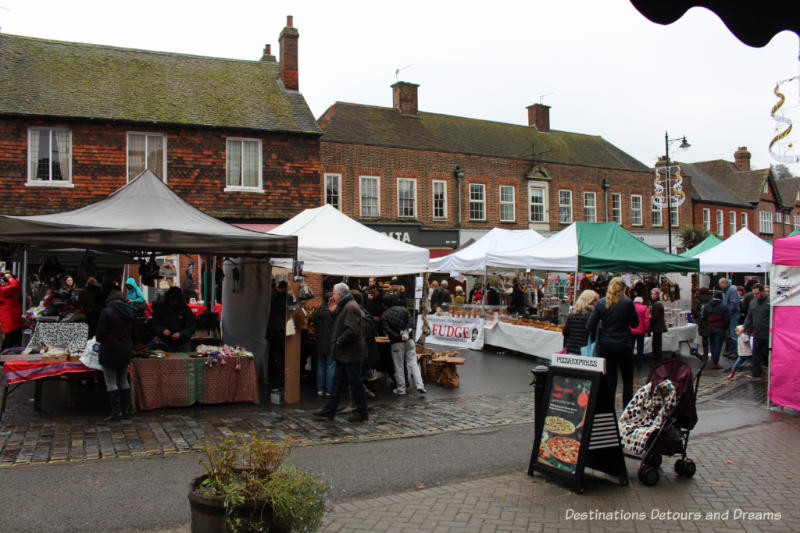
This screenshot has height=533, width=800. What are the coordinates of `chimneys` in the screenshot? It's located at (282, 60), (406, 96), (530, 113), (732, 153).